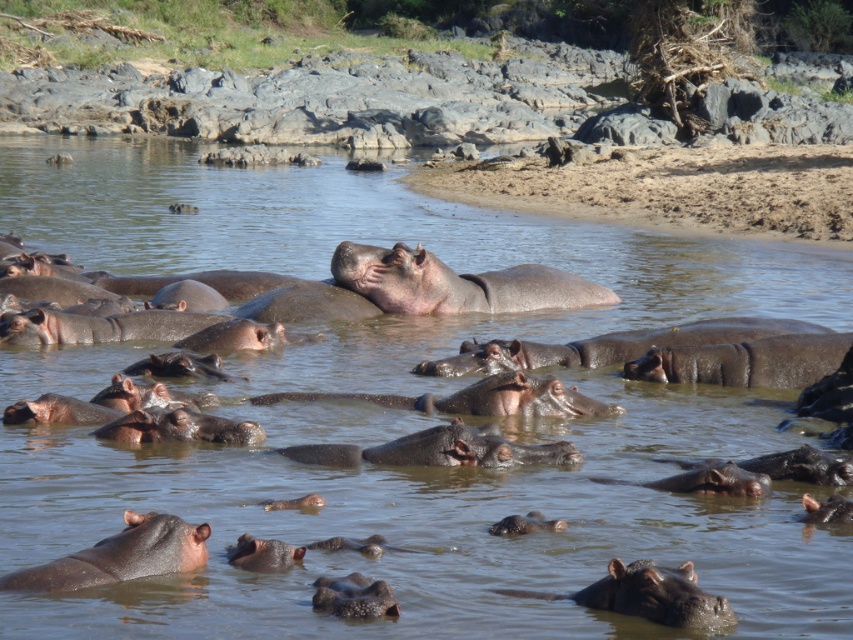
Question: Is brown matte hippo at lower center positioned at the back of dark brown skin at center?

Choices:
 (A) yes
 (B) no

Answer: (B)

Question: Among these objects, which one is nearest to the camera?

Choices:
 (A) grayish-brown skin hippo at center-right
 (B) gray textured hippo at center

Answer: (B)

Question: Is gray matte hippo at center closer to camera compared to dark brown skin at center?

Choices:
 (A) no
 (B) yes

Answer: (A)

Question: Which object is farther from the camera taking this photo?

Choices:
 (A) dark brown skin at lower left
 (B) dark brown skin at center
 (C) grayish-brown skin hippo at center-right

Answer: (C)

Question: Is dark brown skin at lower left positioned in front of brown matte hippo at lower center?

Choices:
 (A) no
 (B) yes

Answer: (A)

Question: Which of these objects is positioned closest to the dark brown skin at center?

Choices:
 (A) grayish-brown skin hippo at center-right
 (B) brown matte hippo at lower center
 (C) gray textured hippo at center
 (D) dark brown skin at lower left

Answer: (D)